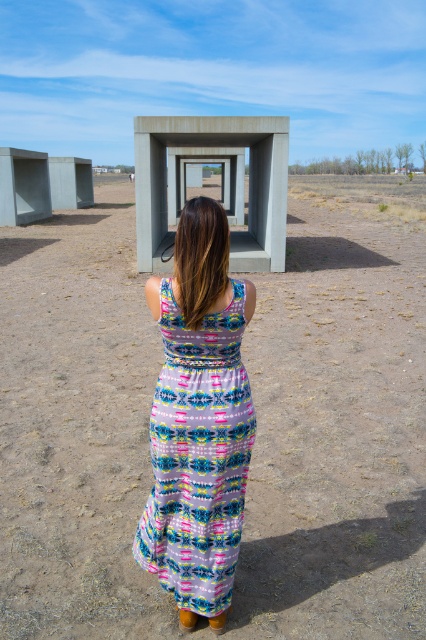
Question: Is brown sandy dirt at center in front of printed fabric dress at center?

Choices:
 (A) no
 (B) yes

Answer: (A)

Question: Based on their relative distances, which object is nearer to the concrete at center?

Choices:
 (A) printed fabric dress at center
 (B) brown sandy dirt at center

Answer: (B)

Question: Can you confirm if brown sandy dirt at center is smaller than printed fabric dress at center?

Choices:
 (A) yes
 (B) no

Answer: (B)

Question: Estimate the real-world distances between objects in this image. Which object is closer to the printed fabric dress at center?

Choices:
 (A) brown sandy dirt at center
 (B) concrete at center

Answer: (A)

Question: Is brown sandy dirt at center to the right of concrete at center from the viewer's perspective?

Choices:
 (A) yes
 (B) no

Answer: (A)

Question: Which object appears farthest from the camera in this image?

Choices:
 (A) brown sandy dirt at center
 (B) printed fabric dress at center

Answer: (A)